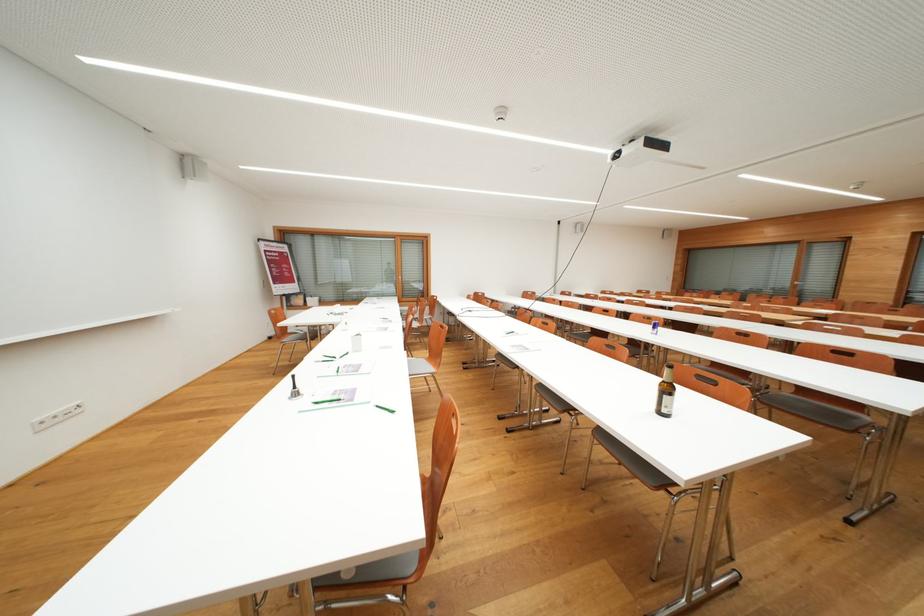
What do you see at coordinates (653, 326) in the screenshot? Image resolution: width=924 pixels, height=616 pixels. I see `a blue drink can` at bounding box center [653, 326].